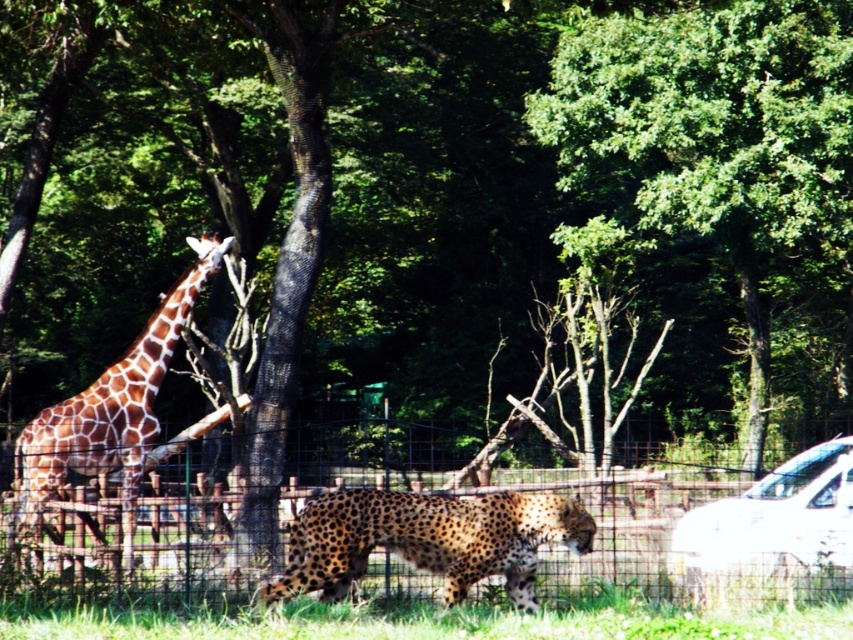
Which is below, metal wire fence at center or white glossy car at lower right?

metal wire fence at center is below.

Does metal wire fence at center have a larger size compared to white glossy car at lower right?

Indeed, metal wire fence at center has a larger size compared to white glossy car at lower right.

The width and height of the screenshot is (853, 640). What do you see at coordinates (579, 541) in the screenshot? I see `metal wire fence at center` at bounding box center [579, 541].

You are a GUI agent. You are given a task and a screenshot of the screen. Output one action in this format:
    pyautogui.click(x=<x>, y=<y>)
    Task: Click on the metal wire fence at center
    
    Given the screenshot: What is the action you would take?
    pyautogui.click(x=579, y=541)

Is point (807, 573) in front of point (96, 449)?

Yes, point (807, 573) is in front of point (96, 449).

Who is higher up, white glossy car at lower right or brown spotted giraffe at left?

brown spotted giraffe at left is higher up.

The image size is (853, 640). Describe the element at coordinates (772, 532) in the screenshot. I see `white glossy car at lower right` at that location.

Where is `white glossy car at lower right`? Image resolution: width=853 pixels, height=640 pixels. white glossy car at lower right is located at coordinates (772, 532).

Which is above, spotted fur cheetah at center or brown spotted giraffe at left?

Positioned higher is brown spotted giraffe at left.

Is point (308, 532) positioned after point (76, 397)?

No.

In order to click on spotted fur cheetah at center in this screenshot , I will do `click(427, 540)`.

At what (x,y) coordinates should I click in order to perform the action: click on spotted fur cheetah at center. Please return your answer as a coordinate pair (x, y). This screenshot has height=640, width=853. Looking at the image, I should click on (427, 540).